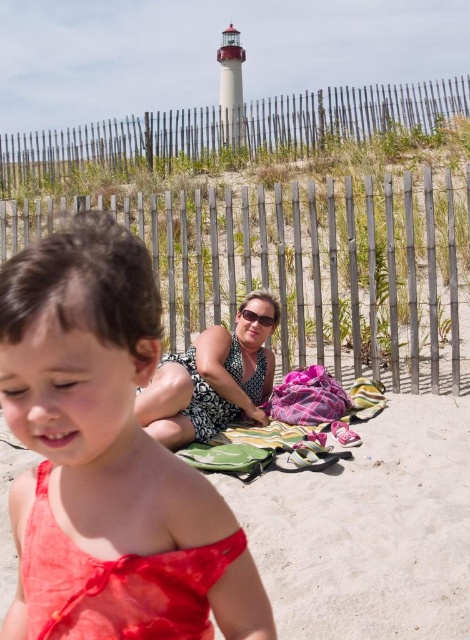
Which is in front, point (170, 625) or point (313, 408)?

Point (170, 625)

Is matte red bikini top at lower left shorter than striped cotton blanket at center?

Yes, matte red bikini top at lower left is shorter than striped cotton blanket at center.

What do you see at coordinates (116, 582) in the screenshot? Image resolution: width=470 pixels, height=640 pixels. I see `matte red bikini top at lower left` at bounding box center [116, 582].

This screenshot has height=640, width=470. What are the coordinates of `matte red bikini top at lower left` in the screenshot? It's located at (116, 582).

Who is lower down, matte black dress at center or striped cotton blanket at center?

Positioned lower is striped cotton blanket at center.

Which is more to the left, matte black dress at center or striped cotton blanket at center?

matte black dress at center is more to the left.

At what (x,y) coordinates should I click in order to perform the action: click on matte black dress at center. Please return your answer as a coordinate pair (x, y). This screenshot has height=640, width=470. Looking at the image, I should click on (212, 378).

Looking at this image, does matte red bikini top at lower left have a smaller size compared to matte black dress at center?

Yes, matte red bikini top at lower left is smaller than matte black dress at center.

Who is shorter, matte red bikini top at lower left or matte black dress at center?

matte red bikini top at lower left

Describe the element at coordinates (116, 582) in the screenshot. I see `matte red bikini top at lower left` at that location.

At what (x,y) coordinates should I click in order to perform the action: click on matte red bikini top at lower left. Please return your answer as a coordinate pair (x, y). This screenshot has height=640, width=470. Looking at the image, I should click on (116, 582).